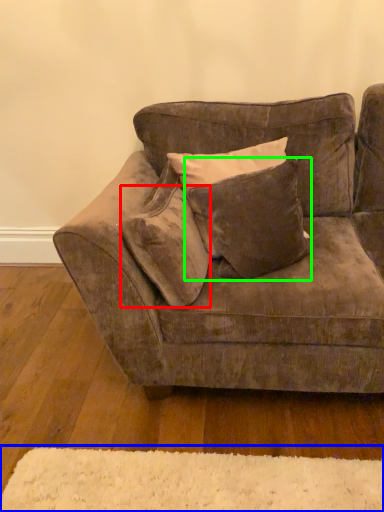
Question: Which object is positioned farthest from pillow (highlighted by a red box)? Select from mat (highlighted by a blue box) and pillow (highlighted by a green box).

Choices:
 (A) mat
 (B) pillow

Answer: (A)